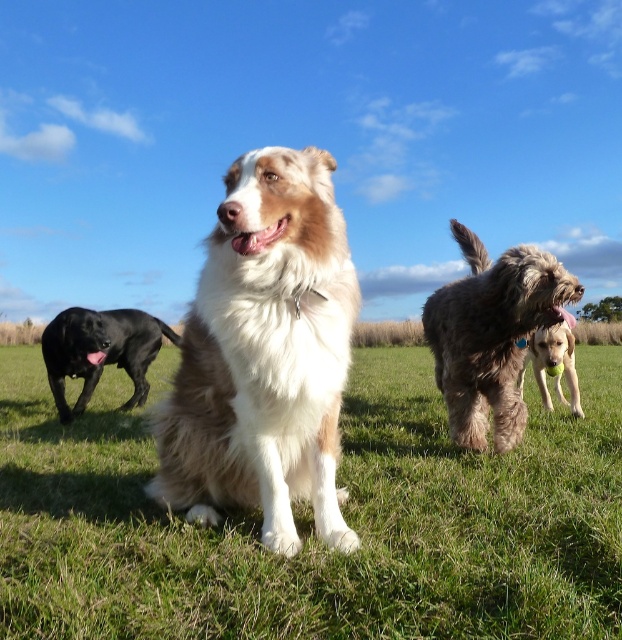
Is white fluffy dog at center smaller than golden fur ball at center?

Incorrect, white fluffy dog at center is not smaller in size than golden fur ball at center.

Looking at this image, measure the distance from white fluffy dog at center to golden fur ball at center.

The distance of white fluffy dog at center from golden fur ball at center is 5.61 feet.

Which is behind, point (60, 616) or point (545, 392)?

Point (545, 392)

Where is `white fluffy dog at center`? white fluffy dog at center is located at coordinates (312, 522).

Measure the distance between brown/white fur dog at center and fluffy brown dog at center right.

The distance of brown/white fur dog at center from fluffy brown dog at center right is 6.81 feet.

Based on the photo, who is lower down, brown/white fur dog at center or fluffy brown dog at center right?

brown/white fur dog at center is below.

The image size is (622, 640). Find the location of `brown/white fur dog at center`. brown/white fur dog at center is located at coordinates (264, 355).

You are a GUI agent. You are given a task and a screenshot of the screen. Output one action in this format:
    pyautogui.click(x=<x>, y=<y>)
    Task: Click on the brown/white fur dog at center
    The height and width of the screenshot is (640, 622).
    Given the screenshot: What is the action you would take?
    pyautogui.click(x=264, y=355)

This screenshot has height=640, width=622. What do you see at coordinates (100, 352) in the screenshot?
I see `shiny black dog at left` at bounding box center [100, 352].

Describe the element at coordinates (100, 352) in the screenshot. This screenshot has height=640, width=622. I see `shiny black dog at left` at that location.

I want to click on shiny black dog at left, so click(100, 352).